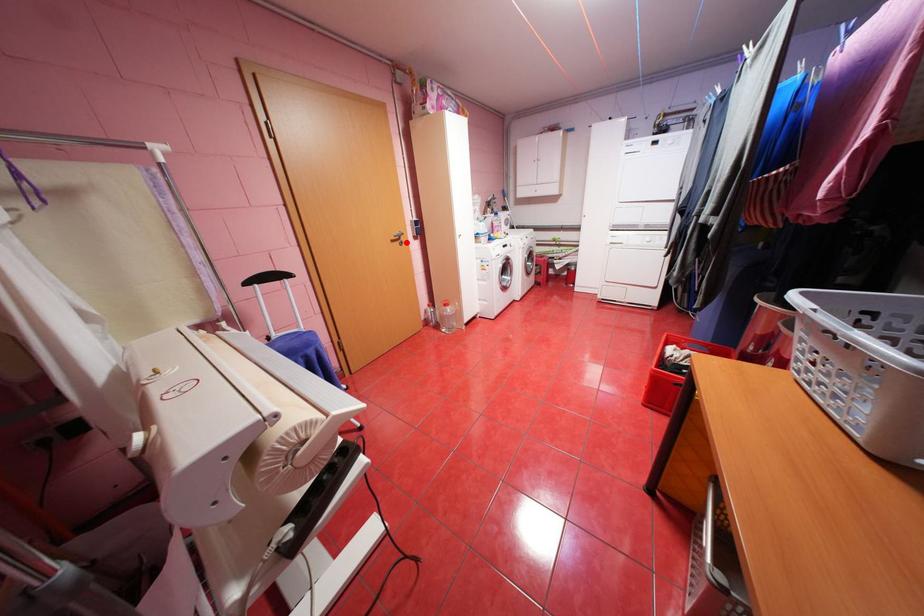
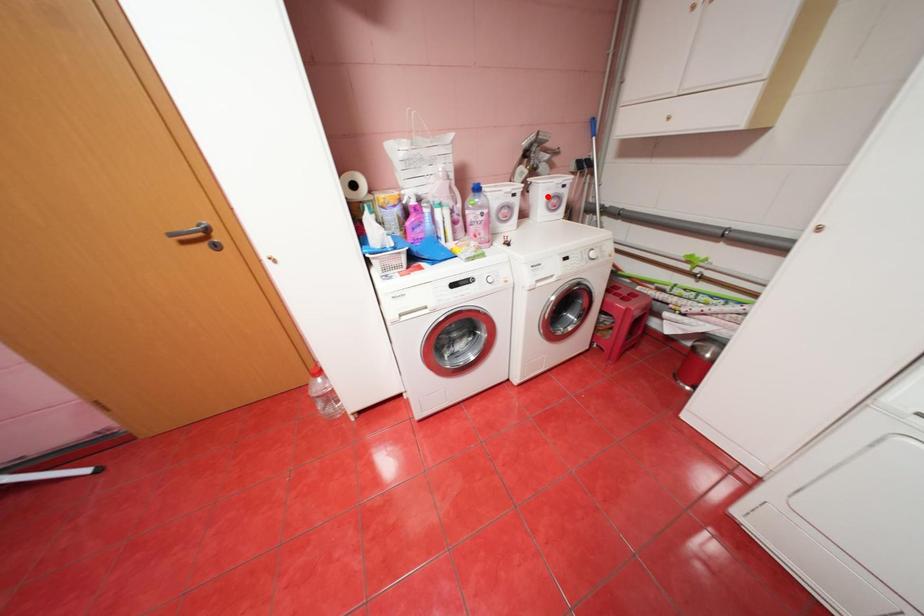
I am providing you with two images of the same scene from different viewpoints. A red point is marked on the first image and another point is marked on the second image. Do the highlighted points in image1 and image2 indicate the same real-world spot?

No